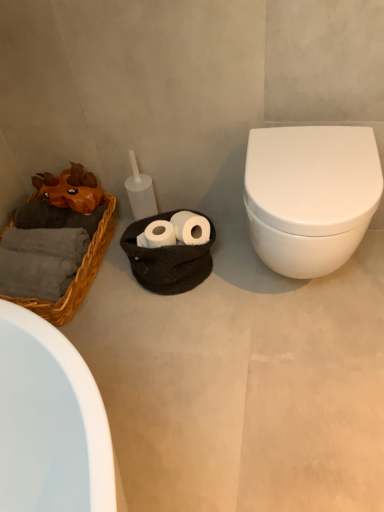
Describe the element at coordinates (70, 189) in the screenshot. I see `orange chiffonier at left` at that location.

Image resolution: width=384 pixels, height=512 pixels. What do you see at coordinates (310, 195) in the screenshot?
I see `white glossy toilet at right` at bounding box center [310, 195].

Consider the image. What is the approximate height of white matte toilet at right?

It is 1.63 inches.

You are a GUI agent. You are given a task and a screenshot of the screen. Output one action in this format:
    pyautogui.click(x=<x>, y=<y>)
    Task: Click on the orange chiffonier at left
    
    Given the screenshot: What is the action you would take?
    pyautogui.click(x=70, y=189)

In the image, is white matte toilet at right positioned in front of or behind woven wicker basket at left?

In the image, white matte toilet at right appears in front of woven wicker basket at left.

Is white matte toilet at right not inside woven wicker basket at left?

white matte toilet at right lies outside woven wicker basket at left's area.

Could you tell me if white matte toilet at right is turned towards woven wicker basket at left?

No, white matte toilet at right is not aimed at woven wicker basket at left.

Is white matte toilet at right far from woven wicker basket at left?

No, there isn't a large distance between white matte toilet at right and woven wicker basket at left.

From the picture: Can you tell me how much white glossy toilet at right and orange chiffonier at left differ in facing direction?

white glossy toilet at right and orange chiffonier at left are facing 1.95 degrees away from each other.

Which object is closer to the camera, white glossy toilet at right or orange chiffonier at left?

white glossy toilet at right.

Which of these two, white glossy toilet at right or orange chiffonier at left, is smaller?

orange chiffonier at left is smaller.

Looking at this image, from the image's perspective, is white glossy toilet at right over orange chiffonier at left?

No, from the image's perspective, white glossy toilet at right is not over orange chiffonier at left.

Considering the relative positions of woven wicker basket at left and white glossy toilet at right in the image provided, is woven wicker basket at left in front of white glossy toilet at right?

No, woven wicker basket at left is further to the viewer.

Does woven wicker basket at left have a greater height compared to white glossy toilet at right?

No.

Considering the sizes of woven wicker basket at left and white glossy toilet at right in the image, is woven wicker basket at left wider or thinner than white glossy toilet at right?

In the image, woven wicker basket at left appears to be wider than white glossy toilet at right.

Is woven wicker basket at left facing towards white matte toilet at right?

No.

Consider the image. Which of these two, woven wicker basket at left or white matte toilet at right, is bigger?

Bigger between the two is white matte toilet at right.

Which is nearer, (8,228) or (225,234)?

Positioned in front is point (8,228).

How many degrees apart are the facing directions of woven wicker basket at left and white matte toilet at right?

88 degrees separate the facing orientations of woven wicker basket at left and white matte toilet at right.

From a real-world perspective, who is located lower, orange chiffonier at left or white matte toilet at right?

white matte toilet at right.

Considering the sizes of orange chiffonier at left and white matte toilet at right in the image, is orange chiffonier at left bigger or smaller than white matte toilet at right?

In the image, orange chiffonier at left appears to be smaller than white matte toilet at right.

Based on the photo, which object is thinner, orange chiffonier at left or white matte toilet at right?

Thinner between the two is orange chiffonier at left.

Visually, is orange chiffonier at left positioned to the left or to the right of white matte toilet at right?

orange chiffonier at left is to the left of white matte toilet at right.

Between point (361, 247) and point (83, 185), which one is positioned behind?

The point (83, 185) is farther.

From the image's perspective, who appears lower, white matte toilet at right or orange chiffonier at left?

white matte toilet at right is shown below in the image.

Is white matte toilet at right in front of or behind orange chiffonier at left in the image?

Visually, white matte toilet at right is located in front of orange chiffonier at left.

Is orange chiffonier at left a part of white matte toilet at right?

No, orange chiffonier at left is not a part of white matte toilet at right.

From a real-world perspective, does white glossy toilet at right sit lower than woven wicker basket at left?

→ Actually, white glossy toilet at right is physically above woven wicker basket at left in the real world.

Is woven wicker basket at left at the back of white glossy toilet at right?

No, white glossy toilet at right is not facing the opposite direction of woven wicker basket at left.

Is white glossy toilet at right surrounding woven wicker basket at left?

No, white glossy toilet at right does not contain woven wicker basket at left.

Find the location of a particular element. Image resolution: width=384 pixels, height=512 pixels. toilet on the right of the woven wicker basket at left is located at coordinates (310, 195).

What are the coordinates of `basket above the white matte toilet at right (from the image's perspective)` in the screenshot? It's located at (77, 273).

Where is `toilet on the right of orange chiffonier at left`? Image resolution: width=384 pixels, height=512 pixels. toilet on the right of orange chiffonier at left is located at coordinates (310, 195).

When comparing their distances from orange chiffonier at left, does white matte toilet at right or woven wicker basket at left seem further?

white matte toilet at right lies further to orange chiffonier at left than the other object.

Which object lies further to the anchor point orange chiffonier at left, white glossy toilet at right or woven wicker basket at left?

Among the two, white glossy toilet at right is located further to orange chiffonier at left.

From the image, which object appears to be nearer to white matte toilet at right, woven wicker basket at left or white glossy toilet at right?

white glossy toilet at right is positioned closer to the anchor white matte toilet at right.

Considering their positions, is white glossy toilet at right positioned further to orange chiffonier at left than white matte toilet at right?

Among the two, white glossy toilet at right is located further to orange chiffonier at left.

Which object lies nearer to the anchor point woven wicker basket at left, white matte toilet at right or orange chiffonier at left?

orange chiffonier at left lies closer to woven wicker basket at left than the other object.

Looking at the image, which one is located further to orange chiffonier at left, woven wicker basket at left or white matte toilet at right?

white matte toilet at right.

From the image, which object appears to be farther from white glossy toilet at right, orange chiffonier at left or white matte toilet at right?

Based on the image, orange chiffonier at left appears to be further to white glossy toilet at right.

From the image, which object appears to be nearer to white matte toilet at right, white glossy toilet at right or orange chiffonier at left?

Based on the image, white glossy toilet at right appears to be nearer to white matte toilet at right.

Where is `chiffonier located between woven wicker basket at left and white matte toilet at right in the left-right direction`? This screenshot has height=512, width=384. chiffonier located between woven wicker basket at left and white matte toilet at right in the left-right direction is located at coordinates (70, 189).

Locate an element on the screen. The width and height of the screenshot is (384, 512). concrete between woven wicker basket at left and white glossy toilet at right in the horizontal direction is located at coordinates (242, 382).

This screenshot has height=512, width=384. Identify the location of concrete situated between orange chiffonier at left and white glossy toilet at right from left to right. (242, 382).

Find the location of a particular element. This screenshot has height=512, width=384. chiffonier between woven wicker basket at left and white glossy toilet at right in the horizontal direction is located at coordinates (70, 189).